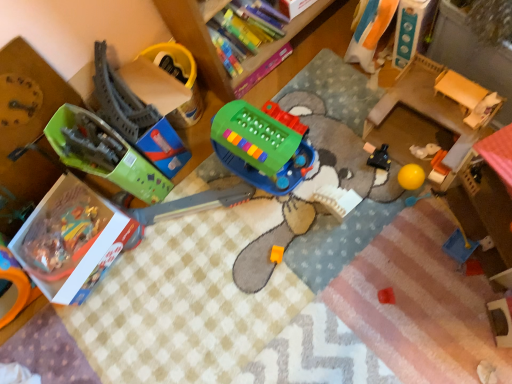
Question: Does wooden changing table at right turn towards wooden bookshelf at upper center?

Choices:
 (A) no
 (B) yes

Answer: (A)

Question: Is wooden changing table at right next to wooden bookshelf at upper center and touching it?

Choices:
 (A) yes
 (B) no

Answer: (B)

Question: Does wooden changing table at right have a lesser height compared to wooden bookshelf at upper center?

Choices:
 (A) no
 (B) yes

Answer: (B)

Question: Does wooden changing table at right have a lesser width compared to wooden bookshelf at upper center?

Choices:
 (A) no
 (B) yes

Answer: (B)

Question: Would you say wooden changing table at right contains wooden bookshelf at upper center?

Choices:
 (A) yes
 (B) no

Answer: (B)

Question: Is wooden changing table at right bigger or smaller than gray plastic train tracks at left, placed as the sixth toy when sorted from right to left?

Choices:
 (A) small
 (B) big

Answer: (A)

Question: Is wooden changing table at right taller or shorter than gray plastic train tracks at left, placed as the sixth toy when sorted from right to left?

Choices:
 (A) short
 (B) tall

Answer: (A)

Question: Considering the positions of wooden changing table at right and gray plastic train tracks at left, marked as the 1th toy in a left-to-right arrangement, in the image, is wooden changing table at right wider or thinner than gray plastic train tracks at left, marked as the 1th toy in a left-to-right arrangement,?

Choices:
 (A) thin
 (B) wide

Answer: (A)

Question: Does point (485, 119) appear closer or farther from the camera than point (125, 145)?

Choices:
 (A) closer
 (B) farther

Answer: (A)

Question: Is wooden bookshelf at upper center wider or thinner than orange fabric doll at upper right, arranged as the third toy when viewed from the right?

Choices:
 (A) wide
 (B) thin

Answer: (A)

Question: From the image's perspective, is wooden bookshelf at upper center located above or below orange fabric doll at upper right, arranged as the third toy when viewed from the right?

Choices:
 (A) below
 (B) above

Answer: (B)

Question: Is wooden bookshelf at upper center situated inside orange fabric doll at upper right, the fourth toy when ordered from left to right, or outside?

Choices:
 (A) inside
 (B) outside

Answer: (B)

Question: From a real-world perspective, relative to orange fabric doll at upper right, arranged as the third toy when viewed from the right, is wooden bookshelf at upper center vertically above or below?

Choices:
 (A) below
 (B) above

Answer: (B)

Question: In terms of width, does orange fabric doll at upper right, arranged as the third toy when viewed from the right, look wider or thinner when compared to matte cardboard box at upper center, which is the first box in top-to-bottom order?

Choices:
 (A) wide
 (B) thin

Answer: (B)

Question: From the image's perspective, is orange fabric doll at upper right, the fourth toy when ordered from left to right, positioned above or below matte cardboard box at upper center, the first box in the right-to-left sequence?

Choices:
 (A) above
 (B) below

Answer: (B)